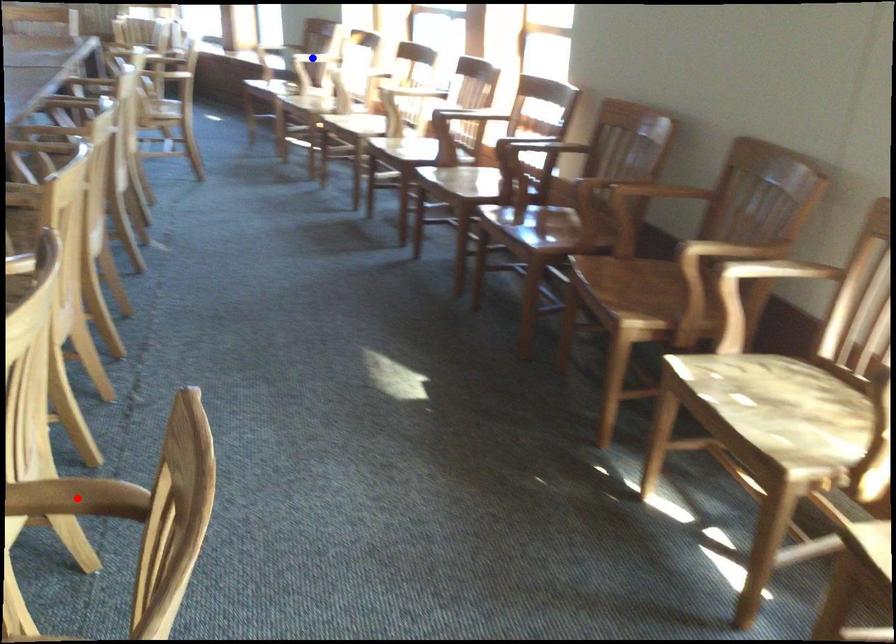
Question: Two points are marked on the image. Which point is closer to the camera?

Choices:
 (A) Blue point is closer.
 (B) Red point is closer.

Answer: (B)